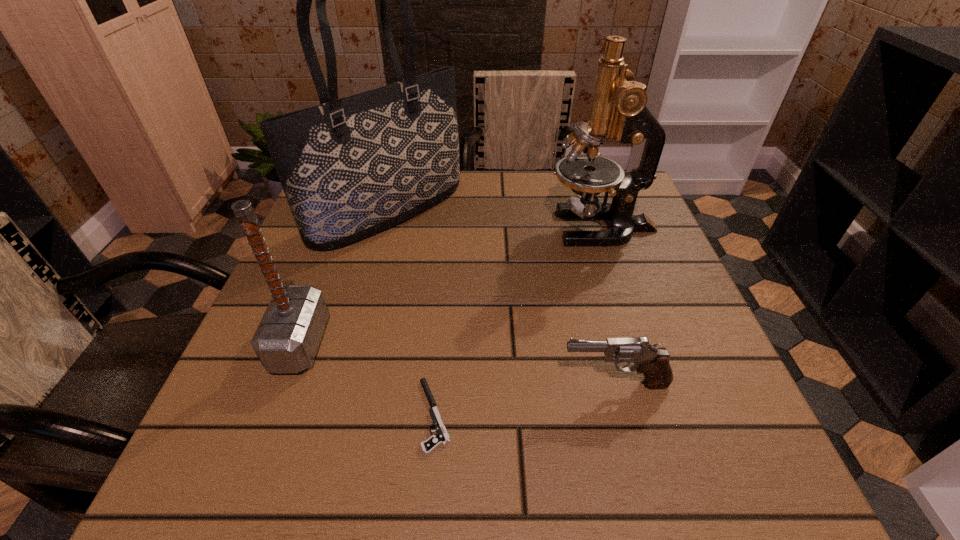
Where is `the tallest object`? The image size is (960, 540). the tallest object is located at coordinates (352, 167).

Find the location of a particular element. the fourth shortest object is located at coordinates (618, 109).

Where is `the third shortest object`? The image size is (960, 540). the third shortest object is located at coordinates (287, 338).

Find the location of a particular element. the fourth tallest object is located at coordinates (653, 362).

You are a GUI agent. You are given a task and a screenshot of the screen. Output one action in this format:
    pyautogui.click(x=<x>, y=<y>)
    Task: Click on the right pistol
    The height and width of the screenshot is (540, 960).
    Given the screenshot: What is the action you would take?
    pyautogui.click(x=653, y=362)

You are a GUI agent. You are given a task and a screenshot of the screen. Output one action in this format:
    pyautogui.click(x=<x>, y=<y>)
    Task: Click on the shortest object
    
    Given the screenshot: What is the action you would take?
    pyautogui.click(x=441, y=437)

At what (x,y) coordinates should I click in order to perform the action: click on the shorter pistol. Please return your answer as a coordinate pair (x, y). Image resolution: width=960 pixels, height=540 pixels. Looking at the image, I should click on (441, 437).

You are a GUI agent. You are given a task and a screenshot of the screen. Output one action in this format:
    pyautogui.click(x=<x>, y=<y>)
    Task: Click on the vacant space located on the front of the tallest object
    The width and height of the screenshot is (960, 540).
    Given the screenshot: What is the action you would take?
    pyautogui.click(x=352, y=347)

The width and height of the screenshot is (960, 540). I want to click on vacant space located 0.370m at the eyepiece of the microscope, so click(x=388, y=227).

Find the location of `vacant area situated at the eyepiece of the microscope`. vacant area situated at the eyepiece of the microscope is located at coordinates (384, 227).